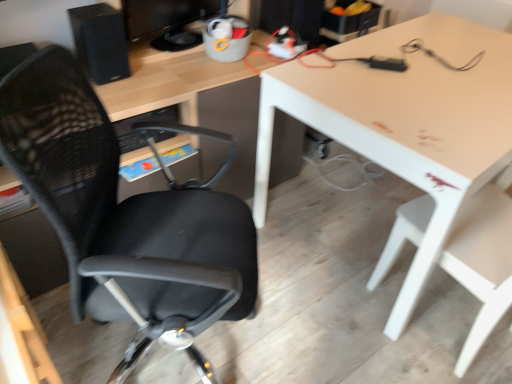
Where is `vacant space to the right of black mesh office chair at left, the first chair viewed from the left`? The image size is (512, 384). vacant space to the right of black mesh office chair at left, the first chair viewed from the left is located at coordinates pos(310,326).